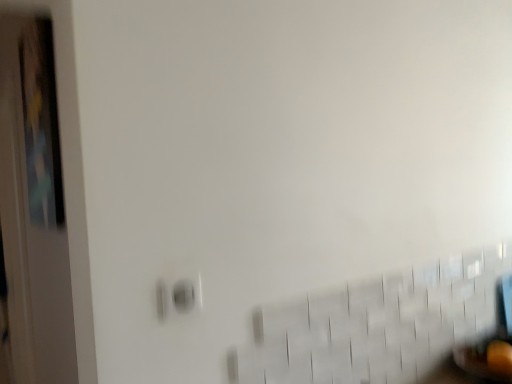
Question: From a real-world perspective, does matte white electric outlet at lower left stand above wooden door at left?

Choices:
 (A) no
 (B) yes

Answer: (B)

Question: Is matte white electric outlet at lower left wider than wooden door at left?

Choices:
 (A) no
 (B) yes

Answer: (A)

Question: Is the position of matte white electric outlet at lower left less distant than that of wooden door at left?

Choices:
 (A) no
 (B) yes

Answer: (B)

Question: Can you confirm if matte white electric outlet at lower left is positioned to the right of wooden door at left?

Choices:
 (A) yes
 (B) no

Answer: (A)

Question: Does matte white electric outlet at lower left have a lesser width compared to wooden door at left?

Choices:
 (A) no
 (B) yes

Answer: (B)

Question: Does matte white electric outlet at lower left touch wooden door at left?

Choices:
 (A) no
 (B) yes

Answer: (A)

Question: Can you confirm if wooden door at left is shorter than matte white electric outlet at lower left?

Choices:
 (A) no
 (B) yes

Answer: (A)

Question: Considering the relative positions of wooden door at left and matte white electric outlet at lower left in the image provided, is wooden door at left to the left of matte white electric outlet at lower left from the viewer's perspective?

Choices:
 (A) no
 (B) yes

Answer: (B)

Question: Considering the relative sizes of wooden door at left and matte white electric outlet at lower left in the image provided, is wooden door at left smaller than matte white electric outlet at lower left?

Choices:
 (A) no
 (B) yes

Answer: (A)

Question: From the image's perspective, is wooden door at left on matte white electric outlet at lower left?

Choices:
 (A) yes
 (B) no

Answer: (B)

Question: Considering the relative positions of wooden door at left and matte white electric outlet at lower left in the image provided, is wooden door at left to the right of matte white electric outlet at lower left from the viewer's perspective?

Choices:
 (A) yes
 (B) no

Answer: (B)

Question: Can you confirm if wooden door at left is bigger than matte white electric outlet at lower left?

Choices:
 (A) no
 (B) yes

Answer: (B)

Question: From a real-world perspective, is wooden door at left above or below matte white electric outlet at lower left?

Choices:
 (A) above
 (B) below

Answer: (B)